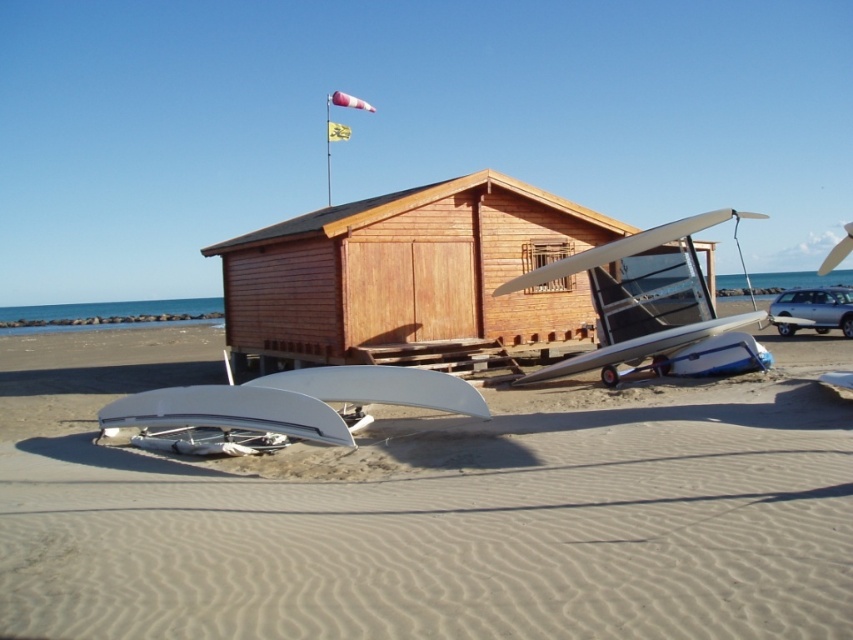
Is white matte surfboard at center taller than white glossy wing at lower center?

Yes.

The height and width of the screenshot is (640, 853). What do you see at coordinates (430, 509) in the screenshot?
I see `white matte surfboard at center` at bounding box center [430, 509].

You are a GUI agent. You are given a task and a screenshot of the screen. Output one action in this format:
    pyautogui.click(x=<x>, y=<y>)
    Task: Click on the white matte surfboard at center
    The width and height of the screenshot is (853, 640).
    Given the screenshot: What is the action you would take?
    pyautogui.click(x=430, y=509)

Does white glossy wing at lower center have a greater height compared to metallic silver airplane at center?

No.

Can you confirm if white glossy wing at lower center is bigger than metallic silver airplane at center?

No.

The image size is (853, 640). I want to click on white glossy wing at lower center, so click(x=281, y=408).

Can you confirm if white matte surfboard at center is taller than metallic silver airplane at center?

Incorrect, white matte surfboard at center's height is not larger of metallic silver airplane at center's.

Which is more to the right, white matte surfboard at center or metallic silver airplane at center?

metallic silver airplane at center

Describe the element at coordinates (430, 509) in the screenshot. This screenshot has width=853, height=640. I see `white matte surfboard at center` at that location.

Where is `white matte surfboard at center`? white matte surfboard at center is located at coordinates (430, 509).